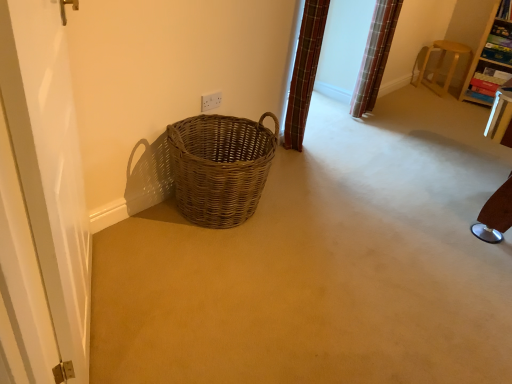
Locate an element on the screen. The image size is (512, 384). vacant area to the right of woven brown basket at center is located at coordinates (x=310, y=218).